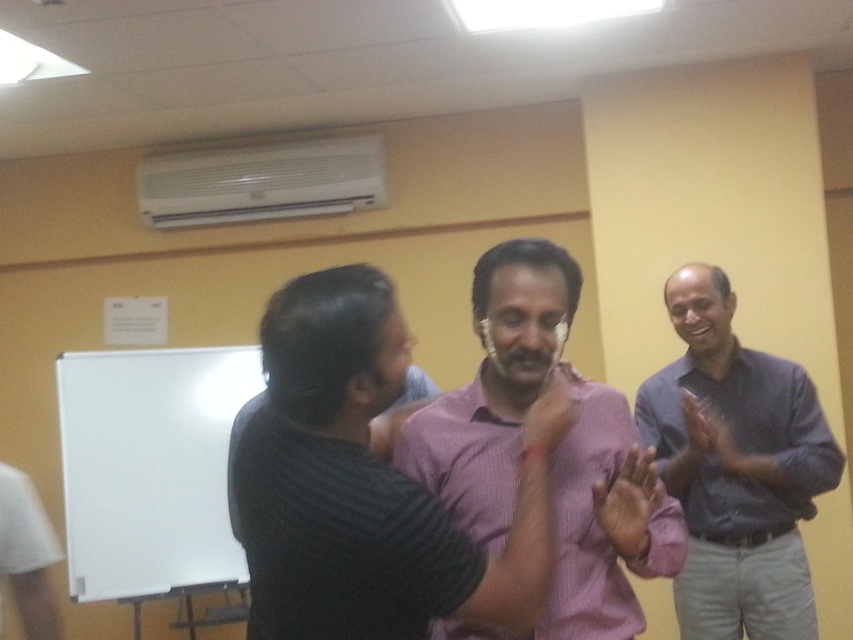
I want to click on pink striped shirt at center, so click(x=367, y=484).

Identify the location of pink striped shirt at center. The image size is (853, 640). (367, 484).

Who is shorter, pink striped shirt at center or gray shirt at right?

Standing shorter between the two is pink striped shirt at center.

Where is `pink striped shirt at center`? This screenshot has width=853, height=640. pink striped shirt at center is located at coordinates (x=367, y=484).

Does point (314, 467) come closer to viewer compared to point (775, 492)?

Yes, it is in front of point (775, 492).

What are the coordinates of `pink striped shirt at center` in the screenshot? It's located at (367, 484).

Is point (552, 260) more distant than point (732, 486)?

No, it is not.

Does point (639, 561) come closer to viewer compared to point (744, 456)?

Yes, it is in front of point (744, 456).

The image size is (853, 640). Identify the location of pink textured shirt at center. point(555,452).